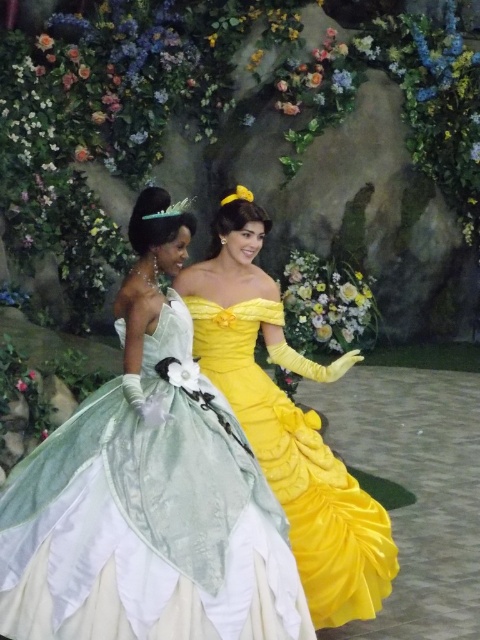
Is matte green gown at center behind yellow satin dress at center?

No.

Who is higher up, matte green gown at center or yellow satin dress at center?

matte green gown at center

At what (x,y) coordinates should I click in order to perform the action: click on matte green gown at center. Please return your answer as a coordinate pair (x, y). Looking at the image, I should click on (147, 492).